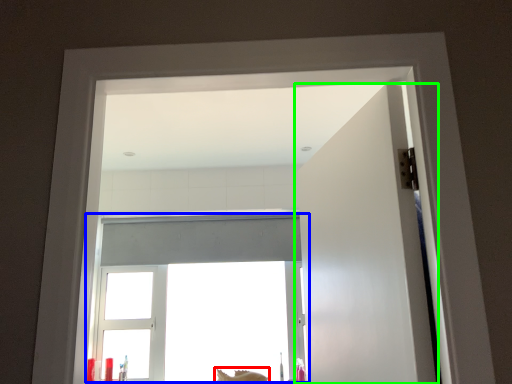
Question: Which object is positioned farthest from animal (highlighted by a red box)? Select from window (highlighted by a blue box) and door (highlighted by a green box).

Choices:
 (A) window
 (B) door

Answer: (B)